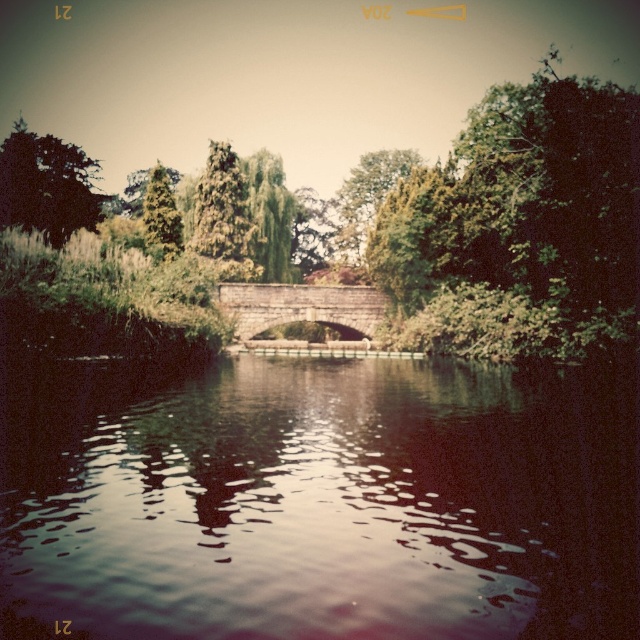
Question: Estimate the real-world distances between objects in this image. Which object is farther from the dark reflective water at center?

Choices:
 (A) green textured tree at upper left
 (B) green leafy tree at upper right
 (C) green leafy tree at upper left

Answer: (A)

Question: Can you confirm if dark reflective water at center is positioned to the left of green leafy tree at upper left?

Choices:
 (A) no
 (B) yes

Answer: (A)

Question: Which of the following is the farthest from the observer?

Choices:
 (A) green leafy tree at upper right
 (B) green textured tree at upper left
 (C) dark reflective water at center
 (D) green leafy tree at upper left

Answer: (B)

Question: Can you confirm if dark reflective water at center is positioned above green leafy tree at upper left?

Choices:
 (A) no
 (B) yes

Answer: (A)

Question: Which of the following is the farthest from the observer?

Choices:
 (A) green leafy tree at upper right
 (B) green leafy tree at upper left

Answer: (B)

Question: Does dark reflective water at center have a greater width compared to green textured tree at upper left?

Choices:
 (A) no
 (B) yes

Answer: (B)